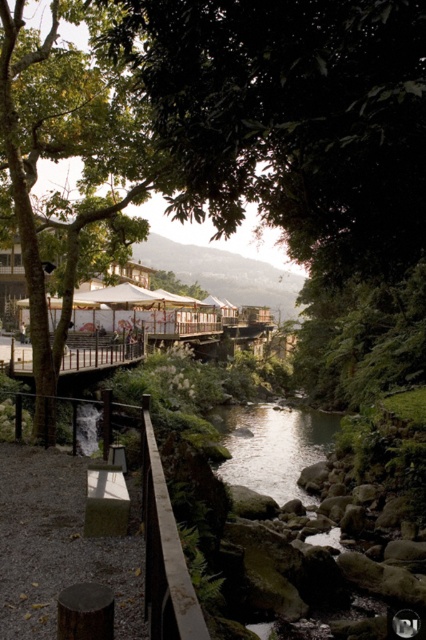
Between point (357, 140) and point (184, 628), which one is positioned in front?

Point (184, 628) is more forward.

Which of these two, green leafy tree at center or brown wooden rail at lower left, stands shorter?

brown wooden rail at lower left is shorter.

Is point (230, 20) positioned in front of point (195, 618)?

No, (230, 20) is further to viewer.

This screenshot has width=426, height=640. Find the location of `green leafy tree at center`. green leafy tree at center is located at coordinates (261, 124).